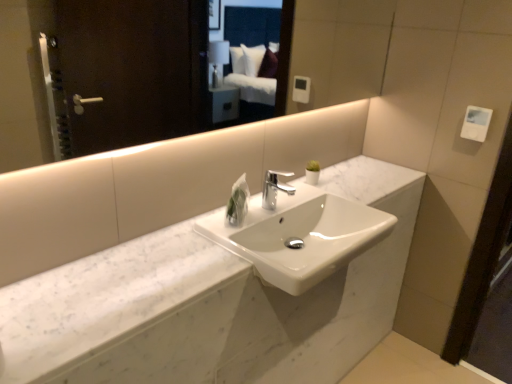
Locate an element on the screen. The height and width of the screenshot is (384, 512). free point above white marble counter at center (from a real-world perspective) is located at coordinates (202, 235).